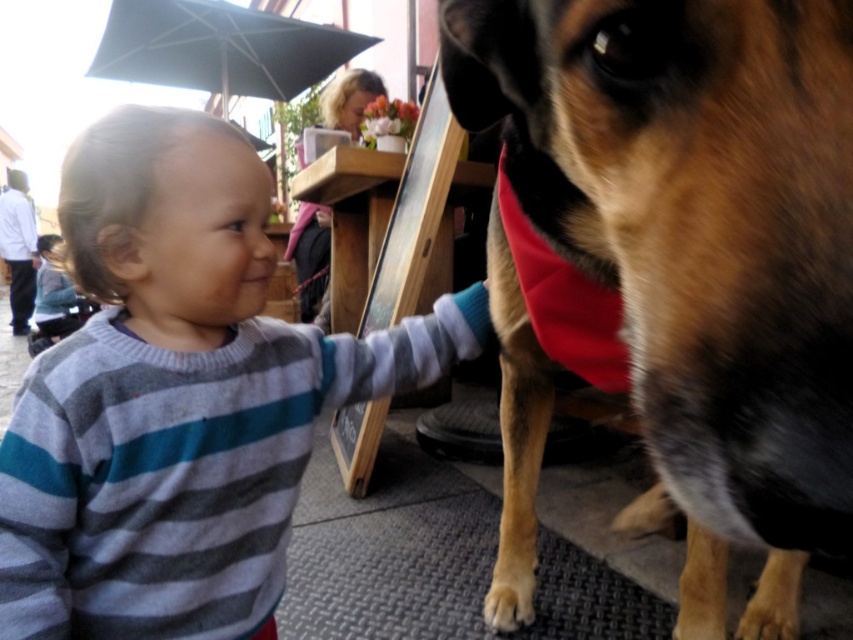
Question: Can you confirm if brown fur dog at center is positioned below striped sweater at center?

Choices:
 (A) yes
 (B) no

Answer: (B)

Question: Which object is the farthest from the brown fur dog at center?

Choices:
 (A) striped sweater at center
 (B) striped sweater at left
 (C) blonde hair at upper center

Answer: (B)

Question: Among these points, which one is farthest from the camera?

Choices:
 (A) (59, 337)
 (B) (325, 310)
 (C) (805, 403)
 (D) (236, 401)

Answer: (A)

Question: Which of the following is the closest to the observer?

Choices:
 (A) brown fur dog at center
 (B) striped sweater at center
 (C) striped sweater at left
 (D) blonde hair at upper center

Answer: (A)

Question: Does blonde hair at upper center appear on the left side of striped sweater at left?

Choices:
 (A) yes
 (B) no

Answer: (B)

Question: Can you confirm if blonde hair at upper center is positioned above striped sweater at left?

Choices:
 (A) no
 (B) yes

Answer: (B)